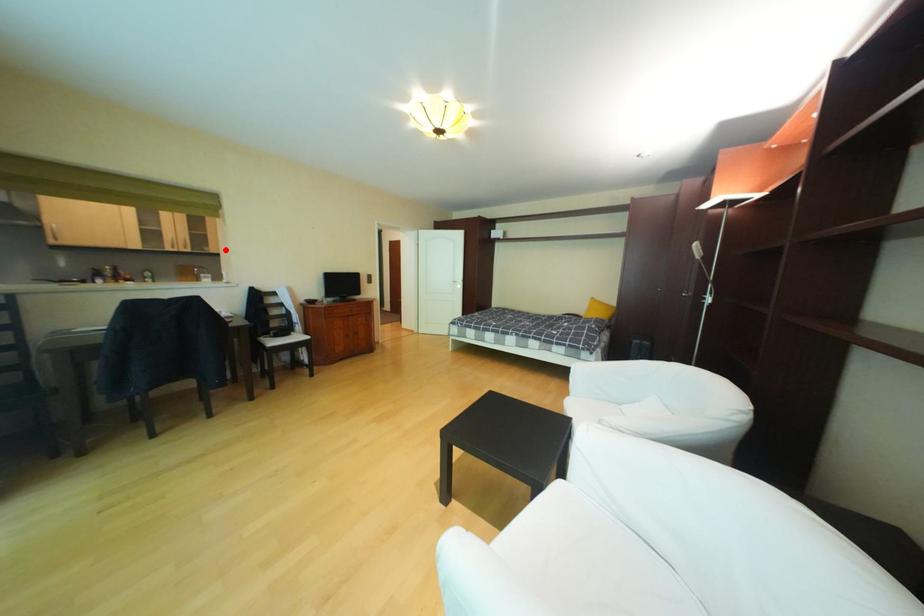
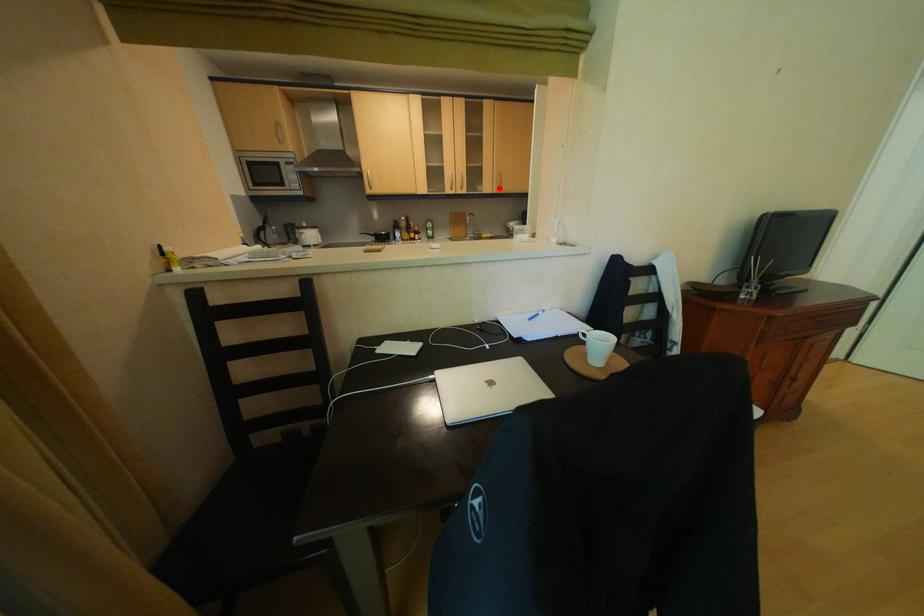
I am providing you with two images of the same scene from different viewpoints. A red point is marked on the first image and another point is marked on the second image. Do the highlighted points in image1 and image2 indicate the same real-world spot?

Yes